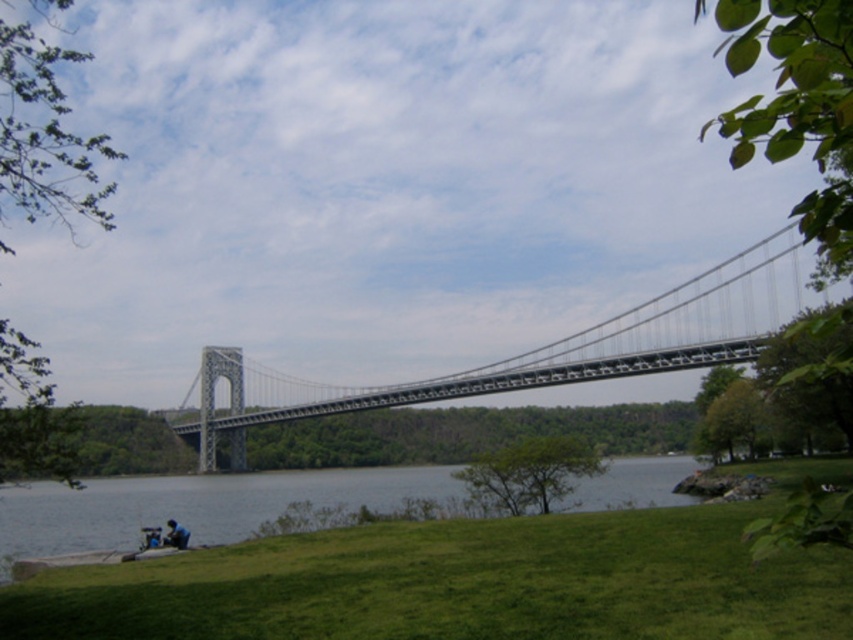
In the scene shown: You are standing at the riverside and see the gray concrete water at lower center and the blue denim jacket at lower left. Which object is nearer to you?

The gray concrete water at lower center is closer to the viewer than the blue denim jacket at lower left, so the gray concrete water at lower center is nearer to you.